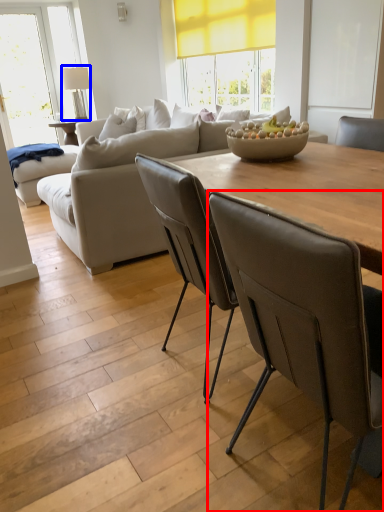
Question: Which object appears closest to the camera in this image, chair (highlighted by a red box) or lamp (highlighted by a blue box)?

Choices:
 (A) chair
 (B) lamp

Answer: (A)